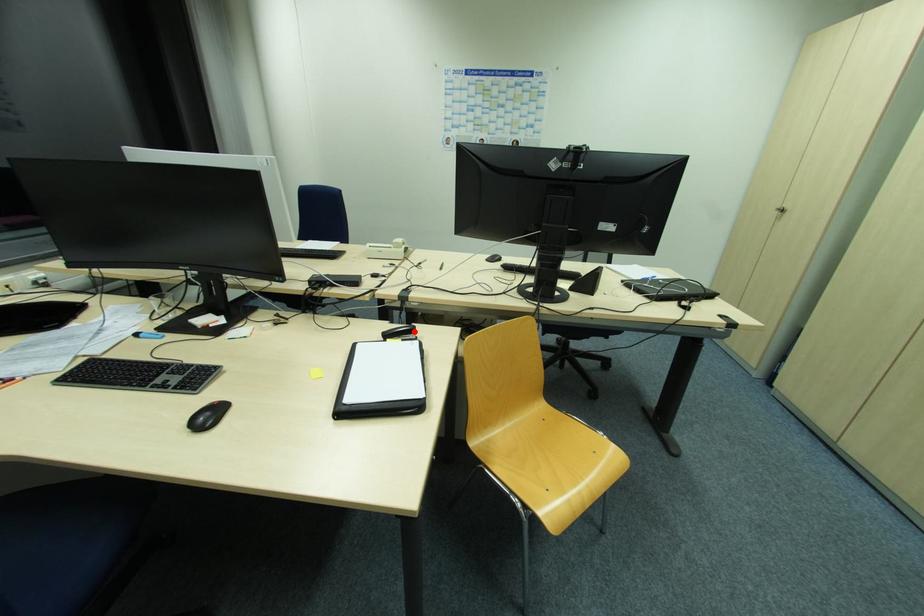
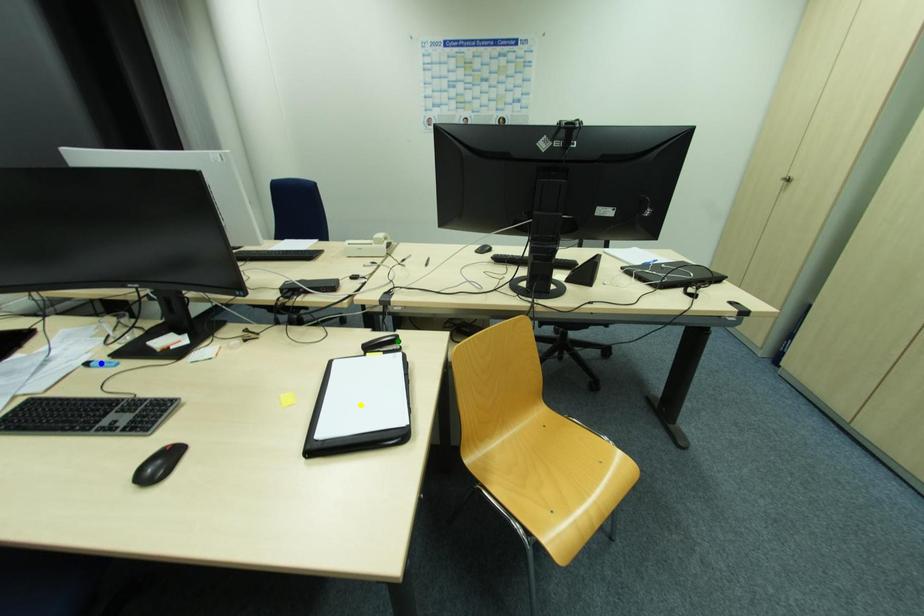
Question: I am providing you with two images of the same scene from different viewpoints. A red point is marked on the first image. You are given multiple points on the second image. Which spot in image 2 lines up with the point in image 1?

Choices:
 (A) blue point
 (B) green point
 (C) yellow point

Answer: (B)